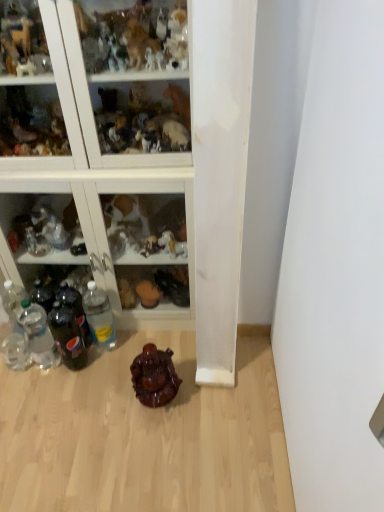
Question: Which is correct: clear plastic bottle at lower left, arranged as the first bottle when viewed from the right, is inside dark glass bottle at lower left, the second bottle in the right-to-left sequence, or outside of it?

Choices:
 (A) inside
 (B) outside

Answer: (B)

Question: From the image's perspective, is clear plastic bottle at lower left, arranged as the first bottle when viewed from the right, above or below dark glass bottle at lower left, which is the 4th bottle in left-to-right order?

Choices:
 (A) above
 (B) below

Answer: (A)

Question: Based on their relative distances, which object is farther from the black plastic bottles at left, the third bottle from the left?

Choices:
 (A) clear plastic bottles at left, the 1th bottle from the left
 (B) clear plastic bottle at lower left, the fifth bottle viewed from the left
 (C) shiny brown statue at center
 (D) dark glass bottle at lower left, the second bottle in the right-to-left sequence
 (E) clear plastic bottles at left, the 4th bottle when ordered from right to left

Answer: (C)

Question: Which is farther from the dark glass bottle at lower left, which is the 4th bottle in left-to-right order?

Choices:
 (A) clear plastic bottle at lower left, the fifth bottle viewed from the left
 (B) clear plastic bottles at left, the 4th bottle when ordered from right to left
 (C) black plastic bottles at left, the third bottle from the left
 (D) clear glass bottles at left, the 1th shelf from the bottom
 (E) translucent glass figurines at upper center, the first shelf positioned from the top

Answer: (E)